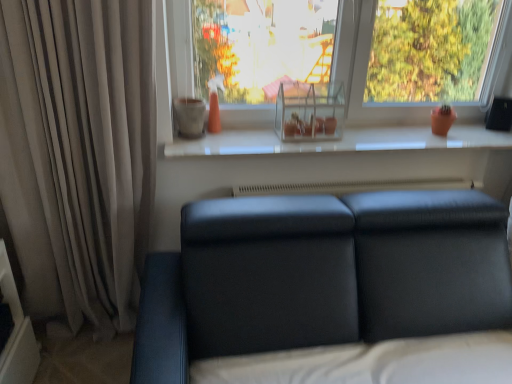
Question: Is beige fabric curtain at left oriented towards transparent glass shelf at upper center?

Choices:
 (A) no
 (B) yes

Answer: (A)

Question: Is beige fabric curtain at left turned away from transparent glass shelf at upper center?

Choices:
 (A) yes
 (B) no

Answer: (B)

Question: Can you confirm if beige fabric curtain at left is shorter than transparent glass shelf at upper center?

Choices:
 (A) yes
 (B) no

Answer: (B)

Question: Is beige fabric curtain at left at the left side of transparent glass shelf at upper center?

Choices:
 (A) yes
 (B) no

Answer: (A)

Question: Considering the relative sizes of beige fabric curtain at left and transparent glass shelf at upper center in the image provided, is beige fabric curtain at left thinner than transparent glass shelf at upper center?

Choices:
 (A) no
 (B) yes

Answer: (A)

Question: Is point (342, 258) positioned closer to the camera than point (395, 130)?

Choices:
 (A) farther
 (B) closer

Answer: (B)

Question: Looking at the image, does matte black couch at lower center seem bigger or smaller compared to white glossy window sill at center?

Choices:
 (A) small
 (B) big

Answer: (B)

Question: From the image's perspective, is matte black couch at lower center above or below white glossy window sill at center?

Choices:
 (A) above
 (B) below

Answer: (B)

Question: In the image, is matte black couch at lower center positioned in front of or behind white glossy window sill at center?

Choices:
 (A) front
 (B) behind

Answer: (A)

Question: In terms of width, does beige fabric curtain at left look wider or thinner when compared to white glossy window sill at center?

Choices:
 (A) thin
 (B) wide

Answer: (A)

Question: Is beige fabric curtain at left inside the boundaries of white glossy window sill at center, or outside?

Choices:
 (A) outside
 (B) inside

Answer: (A)

Question: From a real-world perspective, relative to white glossy window sill at center, is beige fabric curtain at left vertically above or below?

Choices:
 (A) above
 (B) below

Answer: (B)

Question: Is point (138, 213) positioned closer to the camera than point (175, 148)?

Choices:
 (A) farther
 (B) closer

Answer: (B)

Question: From the image's perspective, relative to white glossy window sill at center, is transparent glass shelf at upper center above or below?

Choices:
 (A) below
 (B) above

Answer: (B)

Question: Considering the positions of transparent glass shelf at upper center and white glossy window sill at center in the image, is transparent glass shelf at upper center wider or thinner than white glossy window sill at center?

Choices:
 (A) thin
 (B) wide

Answer: (A)